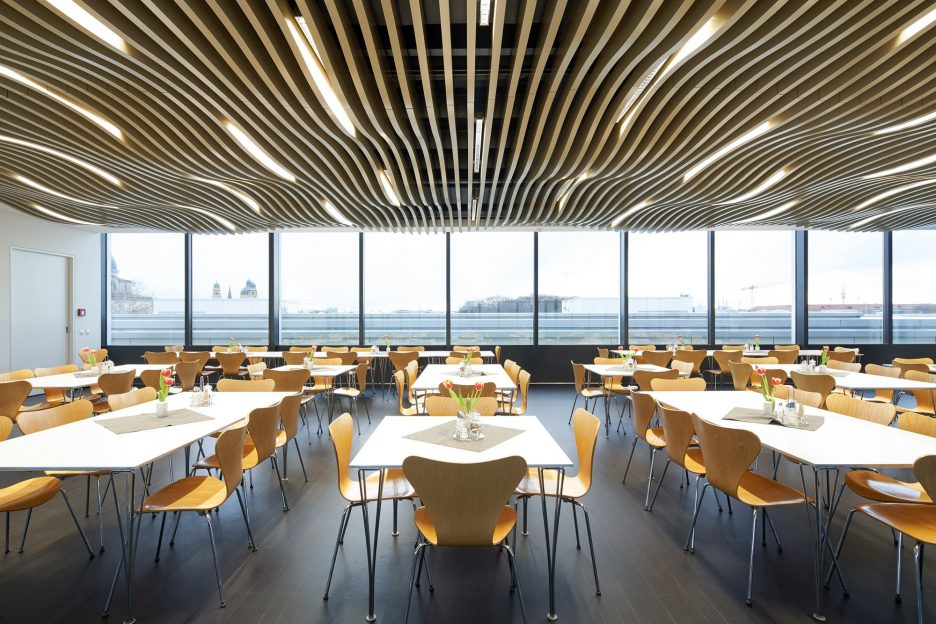
Locate an element on the screen. The height and width of the screenshot is (624, 936). windows is located at coordinates (x=923, y=268), (x=830, y=296), (x=753, y=290), (x=663, y=293), (x=578, y=290), (x=483, y=290), (x=392, y=294), (x=331, y=290), (x=237, y=289), (x=162, y=286).